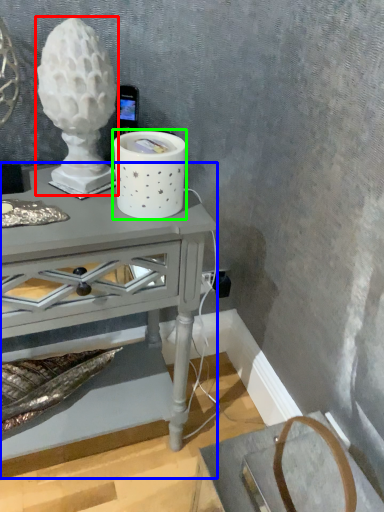
Question: Which object is positioned closest to candle holder (highlighted by a red box)? Select from table (highlighted by a blue box) and candle holder (highlighted by a green box).

Choices:
 (A) table
 (B) candle holder

Answer: (B)